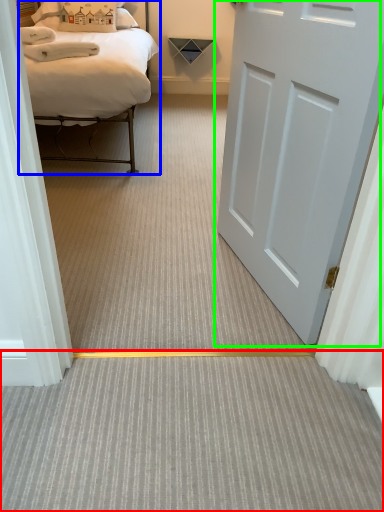
Question: Estimate the real-world distances between objects in this image. Which object is closer to plain (highlighted by a red box), bed (highlighted by a blue box) or door (highlighted by a green box)?

Choices:
 (A) bed
 (B) door

Answer: (B)